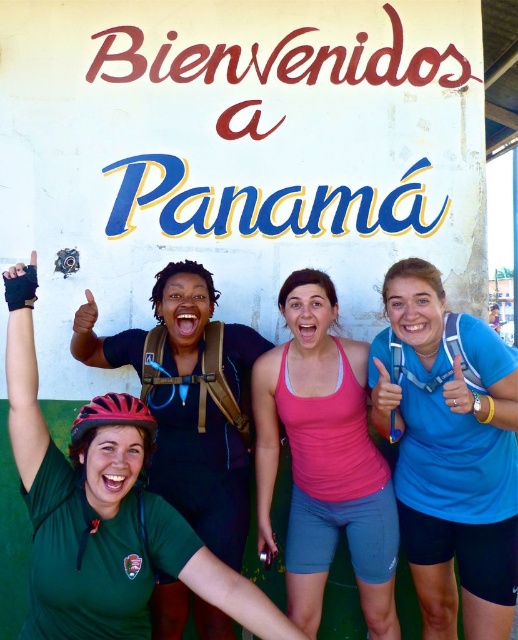
Question: Is blue fabric shirt at center positioned before pink fabric tank top at center?

Choices:
 (A) no
 (B) yes

Answer: (B)

Question: Which object is closer to the camera taking this photo?

Choices:
 (A) red matte bicycle helmet at lower left
 (B) pink fabric tank top at center

Answer: (A)

Question: Can you confirm if pink fabric tank top at center is positioned above red matte bicycle helmet at lower left?

Choices:
 (A) no
 (B) yes

Answer: (A)

Question: Does pink fabric tank top at center appear on the right side of red matte bicycle helmet at lower left?

Choices:
 (A) no
 (B) yes

Answer: (B)

Question: Which of these objects is positioned closest to the matte black helmet at lower left?

Choices:
 (A) pink fabric tank top at center
 (B) red matte bicycle helmet at lower left

Answer: (A)

Question: Which of the following is the farthest from the observer?

Choices:
 (A) pink fabric tank top at center
 (B) blue fabric shirt at center

Answer: (A)